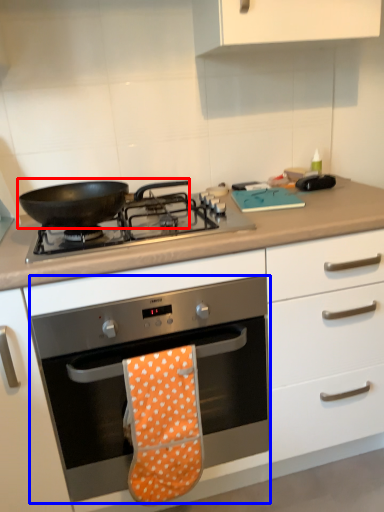
Question: Which object appears closest to the camera in this image, kitchen appliance (highlighted by a red box) or oven (highlighted by a blue box)?

Choices:
 (A) kitchen appliance
 (B) oven

Answer: (B)